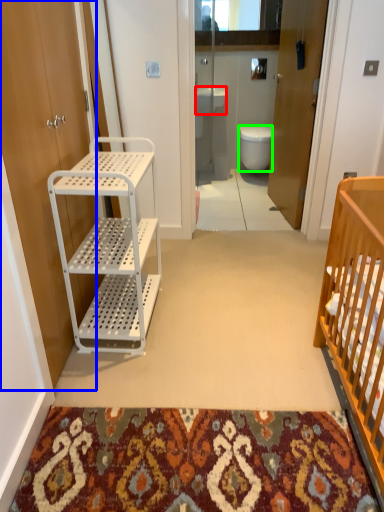
Question: Which is farther away from sink (highlighted by a red box)? door (highlighted by a blue box) or toilet (highlighted by a green box)?

Choices:
 (A) door
 (B) toilet

Answer: (A)